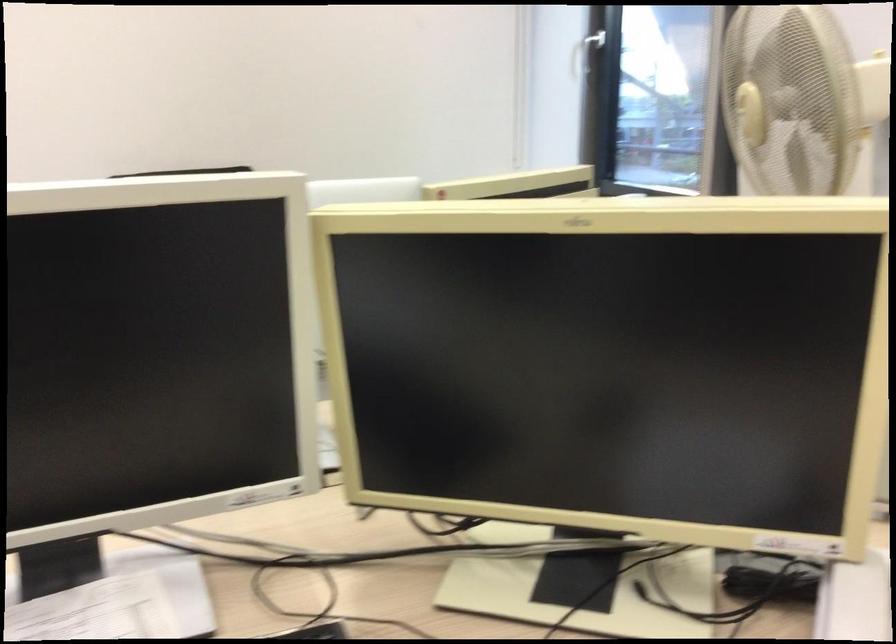
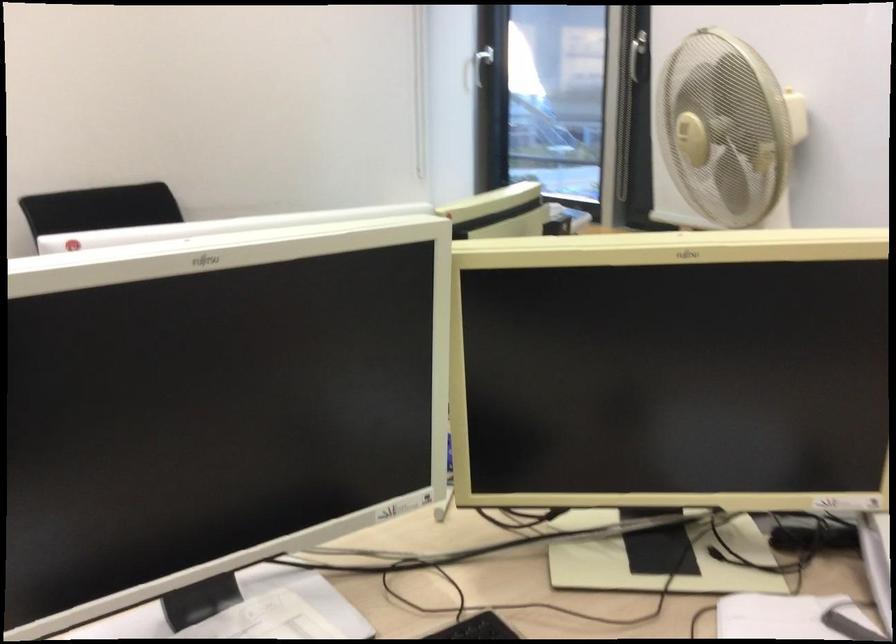
The point at (742, 100) is marked in the first image. Where is the corresponding point in the second image?

(685, 129)